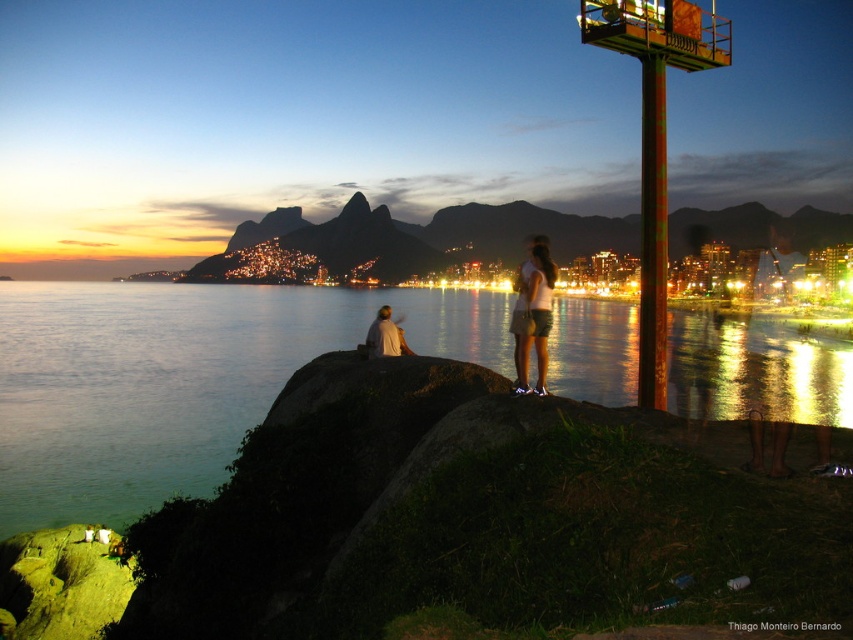
Is point (527, 291) positioned behind point (398, 346)?

No, (527, 291) is in front of (398, 346).

Is point (537, 248) positioned before point (386, 333)?

Yes, point (537, 248) is in front of point (386, 333).

Identify the location of white matte shorts at center. (537, 317).

Is point (195, 397) positioned after point (386, 310)?

Yes, it is behind point (386, 310).

Who is lower down, blue water at center or white fabric shirt at center?

white fabric shirt at center is lower down.

Describe the element at coordinates (177, 380) in the screenshot. I see `blue water at center` at that location.

This screenshot has width=853, height=640. Identify the location of blue water at center. (177, 380).

Is blue water at center bigger than white matte shorts at center?

Yes.

Does blue water at center appear under white matte shorts at center?

Actually, blue water at center is above white matte shorts at center.

You are a GUI agent. You are given a task and a screenshot of the screen. Output one action in this format:
    pyautogui.click(x=<x>, y=<y>)
    Task: Click on the blue water at center
    The image size is (853, 640).
    Given the screenshot: What is the action you would take?
    pyautogui.click(x=177, y=380)